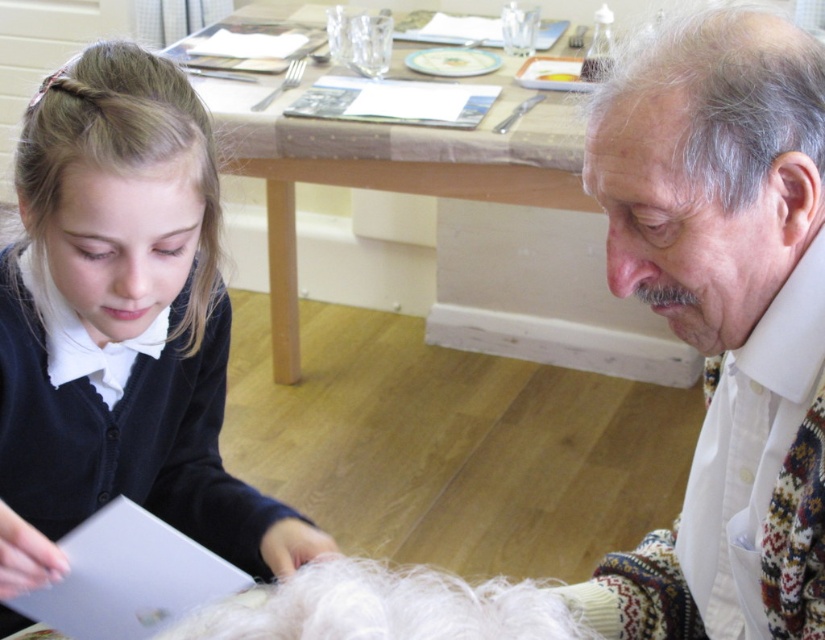
Question: Can you confirm if white textured scarf at right is positioned below blonde silky hair at upper left?

Choices:
 (A) yes
 (B) no

Answer: (A)

Question: Which of the following is the closest to the observer?

Choices:
 (A) white textured scarf at right
 (B) blonde silky hair at upper left
 (C) gray matte hair at upper right
 (D) matte black cardigan at lower left

Answer: (C)

Question: Considering the real-world distances, which object is closest to the white textured scarf at right?

Choices:
 (A) matte black cardigan at lower left
 (B) blonde silky hair at upper left
 (C) gray matte hair at upper right

Answer: (C)

Question: Estimate the real-world distances between objects in this image. Which object is farther from the blonde silky hair at upper left?

Choices:
 (A) white textured scarf at right
 (B) gray matte hair at upper right

Answer: (A)

Question: Can you confirm if white textured scarf at right is positioned above gray matte hair at upper right?

Choices:
 (A) yes
 (B) no

Answer: (B)

Question: Is white textured scarf at right wider than blonde silky hair at upper left?

Choices:
 (A) yes
 (B) no

Answer: (B)